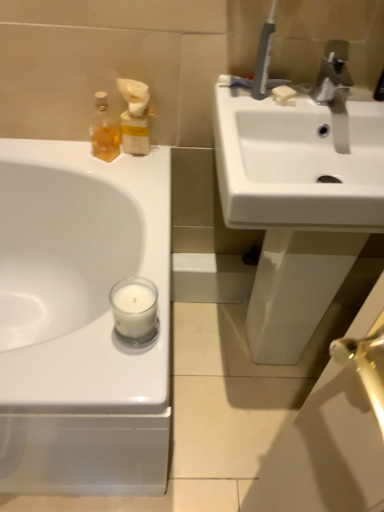
What are the coordinates of `free point to the right of white matte soap at upper right` in the screenshot? It's located at (343, 96).